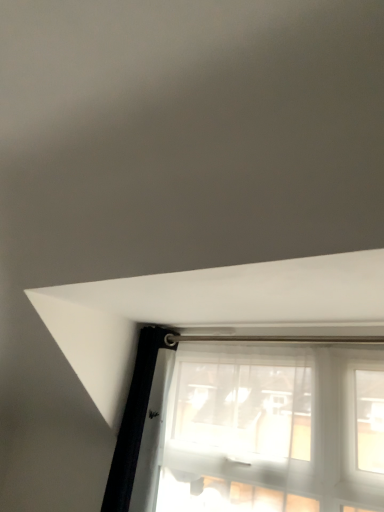
This screenshot has height=512, width=384. Identify the location of metallic silver curtain rod at center. (272, 339).

In order to face metallic silver curtain rod at center, should I rotate leftwards or rightwards?

To align with it, rotate right about 6.470°.

The image size is (384, 512). What do you see at coordinates (272, 339) in the screenshot?
I see `metallic silver curtain rod at center` at bounding box center [272, 339].

Describe the element at coordinates (258, 428) in the screenshot. I see `translucent fabric window at lower center` at that location.

The image size is (384, 512). I want to click on translucent fabric window at lower center, so click(x=258, y=428).

At what (x,y) coordinates should I click in order to perform the action: click on metallic silver curtain rod at center. Please return your answer as a coordinate pair (x, y). The height and width of the screenshot is (512, 384). Looking at the image, I should click on (272, 339).

Considering the relative positions of metallic silver curtain rod at center and translucent fabric window at lower center in the image provided, is metallic silver curtain rod at center to the left of translucent fabric window at lower center from the viewer's perspective?

Indeed, metallic silver curtain rod at center is positioned on the left side of translucent fabric window at lower center.

Between metallic silver curtain rod at center and translucent fabric window at lower center, which one is positioned behind?

metallic silver curtain rod at center is further from the camera.

Does point (251, 336) lie behind point (236, 343)?

No.

From the image's perspective, which is below, metallic silver curtain rod at center or translucent fabric window at lower center?

From the image's view, translucent fabric window at lower center is below.

From a real-world perspective, which object stands above the other?

metallic silver curtain rod at center, from a real-world perspective.

Does metallic silver curtain rod at center have a greater width compared to translucent fabric window at lower center?

Yes.

Considering the sizes of objects metallic silver curtain rod at center and translucent fabric window at lower center in the image provided, who is shorter, metallic silver curtain rod at center or translucent fabric window at lower center?

Standing shorter between the two is metallic silver curtain rod at center.

Which of these two, metallic silver curtain rod at center or translucent fabric window at lower center, is bigger?

With larger size is translucent fabric window at lower center.

Is translucent fabric window at lower center completely or partially inside metallic silver curtain rod at center?

No.

Is metallic silver curtain rod at center positioned far away from translucent fabric window at lower center?

Actually, metallic silver curtain rod at center and translucent fabric window at lower center are a little close together.

Is metallic silver curtain rod at center positioned with its back to translucent fabric window at lower center?

Absolutely, metallic silver curtain rod at center is directed away from translucent fabric window at lower center.

Locate an element on the screen. This screenshot has width=384, height=512. window that appears in front of the metallic silver curtain rod at center is located at coordinates (258, 428).

Considering the positions of objects translucent fabric window at lower center and metallic silver curtain rod at center in the image provided, who is more to the left, translucent fabric window at lower center or metallic silver curtain rod at center?

metallic silver curtain rod at center.

Which object is closer to the camera taking this photo, translucent fabric window at lower center or metallic silver curtain rod at center?

translucent fabric window at lower center is closer to the camera.

Considering the positions of points (247, 385) and (212, 339), is point (247, 385) farther from camera compared to point (212, 339)?

No.

From the image's perspective, is translucent fabric window at lower center under metallic silver curtain rod at center?

Yes, from the image's perspective, translucent fabric window at lower center is below metallic silver curtain rod at center.

From a real-world perspective, is translucent fabric window at lower center beneath metallic silver curtain rod at center?

Yes.

Considering the relative sizes of translucent fabric window at lower center and metallic silver curtain rod at center in the image provided, is translucent fabric window at lower center thinner than metallic silver curtain rod at center?

Indeed, translucent fabric window at lower center has a lesser width compared to metallic silver curtain rod at center.

Is translucent fabric window at lower center taller or shorter than metallic silver curtain rod at center?

translucent fabric window at lower center is taller than metallic silver curtain rod at center.

Considering the sizes of objects translucent fabric window at lower center and metallic silver curtain rod at center in the image provided, who is smaller, translucent fabric window at lower center or metallic silver curtain rod at center?

metallic silver curtain rod at center is smaller.

Can metallic silver curtain rod at center be found inside translucent fabric window at lower center?

No, metallic silver curtain rod at center is not a part of translucent fabric window at lower center.

Is translucent fabric window at lower center directly adjacent to metallic silver curtain rod at center?

translucent fabric window at lower center and metallic silver curtain rod at center are clearly separated.

Is translucent fabric window at lower center facing away from metallic silver curtain rod at center?

That's not correct — translucent fabric window at lower center is not looking away from metallic silver curtain rod at center.

Identify the location of window directly beneath the metallic silver curtain rod at center (from a real-world perspective). This screenshot has height=512, width=384. (258, 428).

In the image, there is a translucent fabric window at lower center. Identify the location of beam above it (from the image's perspective). (272, 339).

Image resolution: width=384 pixels, height=512 pixels. Identify the location of window below the metallic silver curtain rod at center (from a real-world perspective). (258, 428).